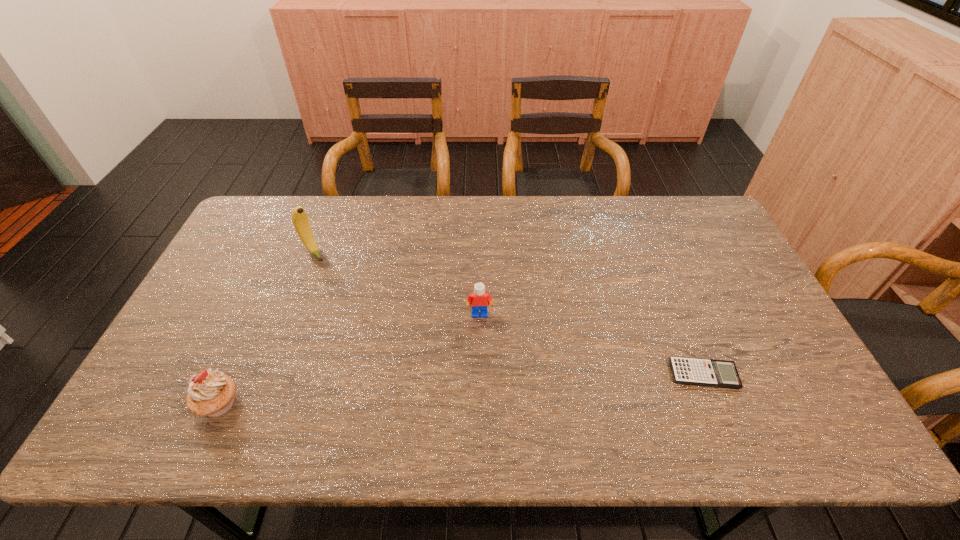
Find the location of a particular element. vacant space at the near edge is located at coordinates (442, 386).

You are a GUI agent. You are given a task and a screenshot of the screen. Output one action in this format:
    pyautogui.click(x=<x>, y=<y>)
    Task: Click on the free region at the left edge of the desktop
    This screenshot has width=960, height=540.
    Given the screenshot: What is the action you would take?
    pyautogui.click(x=245, y=256)

Locate an element on the screen. free space at the right edge is located at coordinates (788, 372).

What are the coordinates of `empty space between the cupcake and the tallest object` in the screenshot? It's located at (267, 328).

The width and height of the screenshot is (960, 540). Identify the location of free space between the banana and the cupcake. (267, 328).

Identify the location of empty space that is in between the tallest object and the Lego. (396, 283).

At what (x,y) coordinates should I click in order to perform the action: click on empty space between the banana and the Lego. Please return your answer as a coordinate pair (x, y). Looking at the image, I should click on (396, 283).

This screenshot has width=960, height=540. Find the location of `free space that is in between the farthest object and the shortest object`. free space that is in between the farthest object and the shortest object is located at coordinates (509, 313).

Locate an element on the screen. Image resolution: width=960 pixels, height=540 pixels. vacant space that is in between the shortest object and the tallest object is located at coordinates (509, 313).

The image size is (960, 540). Find the location of `free space that is in between the calculator and the third nearest object`. free space that is in between the calculator and the third nearest object is located at coordinates (591, 344).